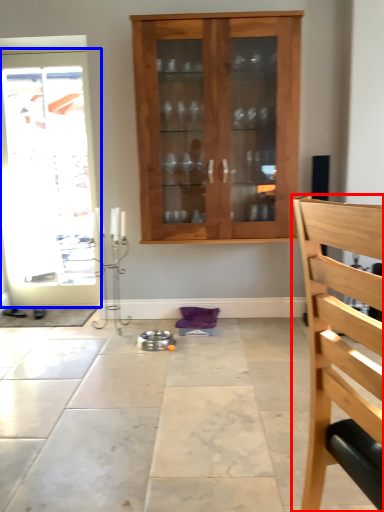
Question: Which object appears closest to the camera in this image, chair (highlighted by a red box) or door (highlighted by a blue box)?

Choices:
 (A) chair
 (B) door

Answer: (A)